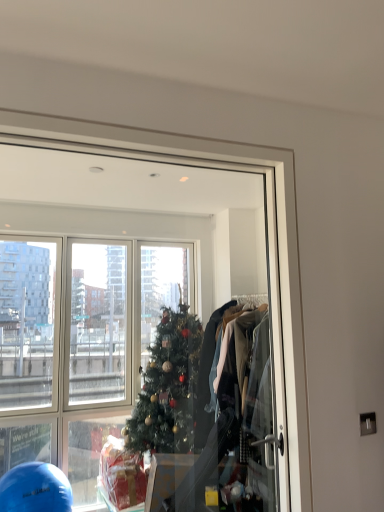
What do you see at coordinates (141, 325) in the screenshot? The image size is (384, 512). I see `transparent glass window at center` at bounding box center [141, 325].

Measure the distance between transparent glass window at center and camera.

1.65 meters.

Locate an element on the screen. The width and height of the screenshot is (384, 512). transparent glass window at center is located at coordinates (141, 325).

The height and width of the screenshot is (512, 384). Find the location of `transparent glass window at center`. transparent glass window at center is located at coordinates click(x=141, y=325).